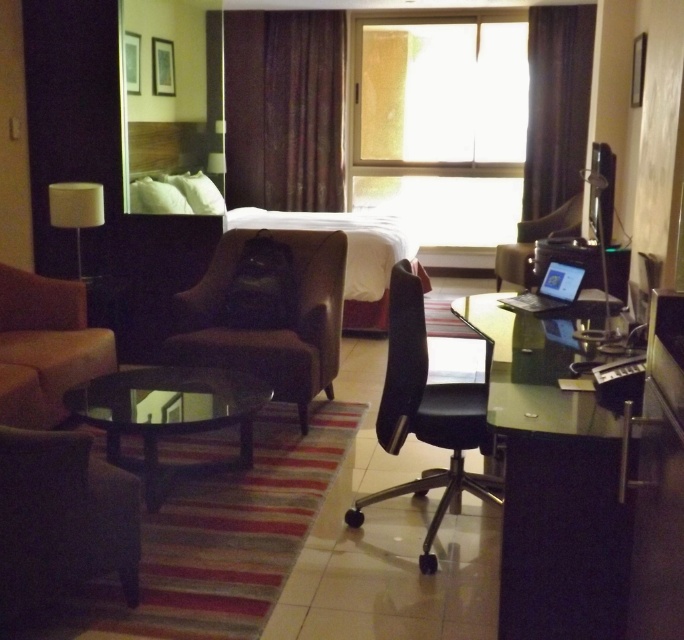
You are trying to decide between sitting in the dark brown leather swivel chair at lower left or the beige fabric couch at lower left. Which option provides more seating space?

The beige fabric couch at lower left provides more seating space because it has a greater width than the dark brown leather swivel chair at lower left.

You are a guest in this hotel room and want to sit down. You see the dark brown leather swivel chair at lower left and the beige fabric couch at lower left. Which one is closer to you?

The dark brown leather swivel chair at lower left is closer to you because it is in front of the beige fabric couch at lower left.

You are in a hotel room and need to sit down. You see a dark brown leather swivel chair at lower left and a beige fabric couch at lower left. Which object is positioned to the right of the other?

The dark brown leather swivel chair at lower left is to the right of the beige fabric couch at lower left.